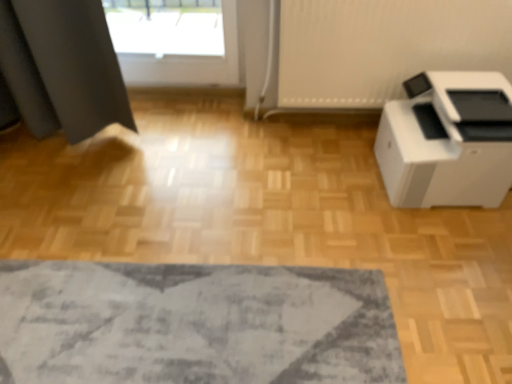
Where is `free space above textured gray rug at lower center (from a real-world perspective)`? The width and height of the screenshot is (512, 384). free space above textured gray rug at lower center (from a real-world perspective) is located at coordinates (89, 318).